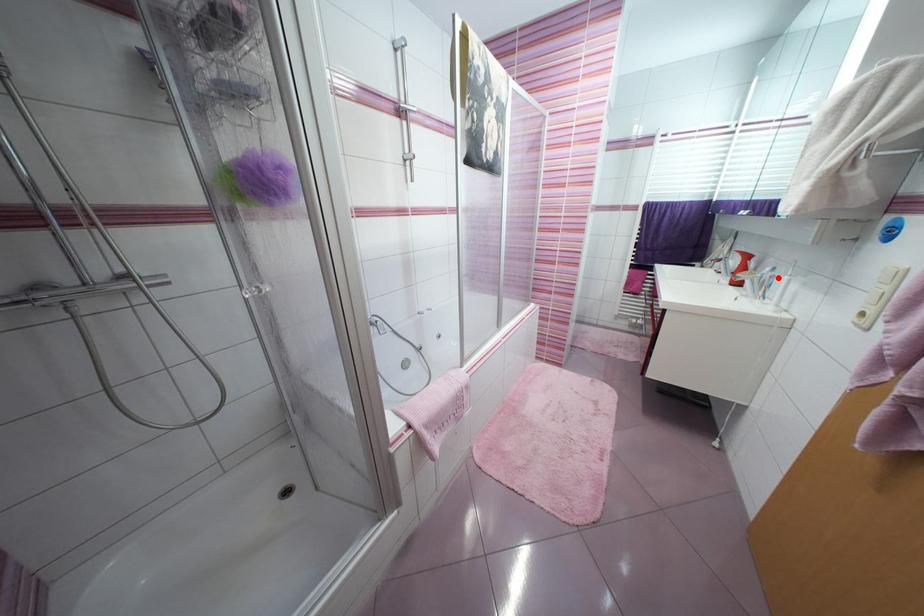
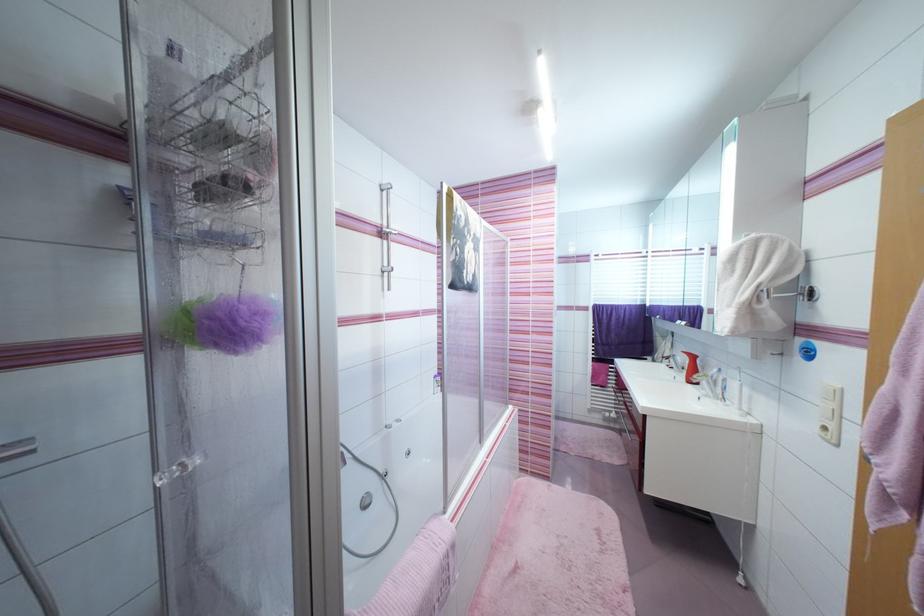
In the second image, find the point that corresponds to the highlighted location in the first image.

(730, 381)